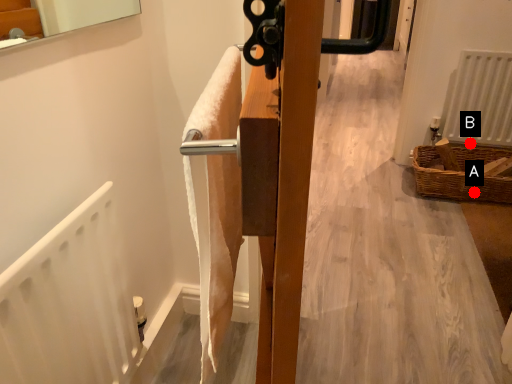
Question: Two points are circled on the image, labeled by A and B beside each circle. Which point appears farthest from the camera in this image?

Choices:
 (A) A is further
 (B) B is further

Answer: (B)